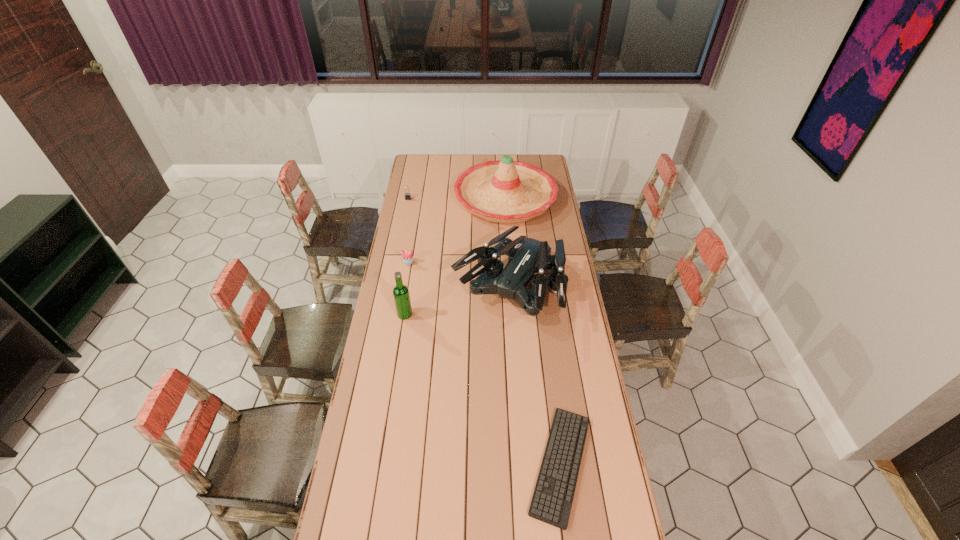
Where is `sombrero`? The width and height of the screenshot is (960, 540). sombrero is located at coordinates (505, 191).

Locate an element on the screen. beer bottle is located at coordinates (401, 295).

This screenshot has width=960, height=540. I want to click on the third tallest object, so click(526, 256).

The width and height of the screenshot is (960, 540). In order to click on the leftmost object in this screenshot , I will do `click(407, 195)`.

Locate an element on the screen. cupcake is located at coordinates (407, 256).

Find the location of a particular element. The width and height of the screenshot is (960, 540). the shortest object is located at coordinates (551, 503).

Identify the location of the nearest object. This screenshot has width=960, height=540. (551, 503).

Where is `vacant space located 0.260m on the left of the sombrero`? Image resolution: width=960 pixels, height=540 pixels. vacant space located 0.260m on the left of the sombrero is located at coordinates (409, 198).

Where is `free space located on the back of the beer bottle`? free space located on the back of the beer bottle is located at coordinates (415, 252).

What are the coordinates of `free point located on the left of the drone` in the screenshot? It's located at (409, 288).